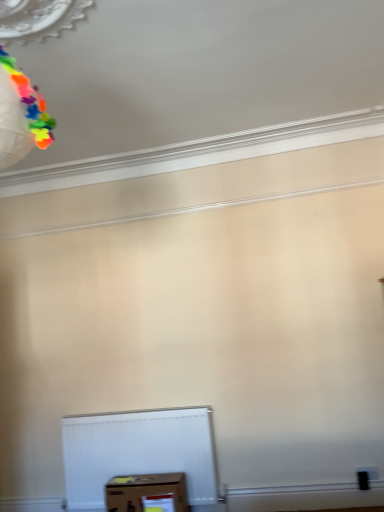
At what (x,y) coordinates should I click in order to perform the action: click on brown cardboard box at lower center. Please return your answer as a coordinate pair (x, y). Image resolution: width=384 pixels, height=512 pixels. Looking at the image, I should click on (146, 492).

This screenshot has width=384, height=512. What do you see at coordinates (146, 492) in the screenshot?
I see `brown cardboard box at lower center` at bounding box center [146, 492].

The image size is (384, 512). What do you see at coordinates (30, 103) in the screenshot?
I see `multicolored paper at upper left` at bounding box center [30, 103].

The image size is (384, 512). I want to click on multicolored paper at upper left, so point(30,103).

The width and height of the screenshot is (384, 512). I want to click on brown cardboard box at lower center, so click(146, 492).

Can you confirm if multicolored paper at upper left is positioned to the left of brown cardboard box at lower center?

Yes.

Does multicolored paper at upper left lie in front of brown cardboard box at lower center?

Yes, multicolored paper at upper left is in front of brown cardboard box at lower center.

Does point (43, 132) come in front of point (115, 485)?

Yes, point (43, 132) is in front of point (115, 485).

From the image's perspective, is multicolored paper at upper left above or below brown cardboard box at lower center?

multicolored paper at upper left is situated higher than brown cardboard box at lower center in the image.

From a real-world perspective, who is located higher, multicolored paper at upper left or brown cardboard box at lower center?

multicolored paper at upper left, from a real-world perspective.

Considering the sizes of multicolored paper at upper left and brown cardboard box at lower center in the image, is multicolored paper at upper left wider or thinner than brown cardboard box at lower center?

multicolored paper at upper left is thinner than brown cardboard box at lower center.

In the scene shown: Considering the relative sizes of multicolored paper at upper left and brown cardboard box at lower center in the image provided, is multicolored paper at upper left shorter than brown cardboard box at lower center?

In fact, multicolored paper at upper left may be taller than brown cardboard box at lower center.

Considering the relative sizes of multicolored paper at upper left and brown cardboard box at lower center in the image provided, is multicolored paper at upper left smaller than brown cardboard box at lower center?

Yes, multicolored paper at upper left is smaller than brown cardboard box at lower center.

Is multicolored paper at upper left positioned beyond the bounds of brown cardboard box at lower center?

That's correct, multicolored paper at upper left is outside of brown cardboard box at lower center.

Are multicolored paper at upper left and brown cardboard box at lower center beside each other?

No, multicolored paper at upper left is not next to brown cardboard box at lower center.

Consider the image. Is multicolored paper at upper left looking in the opposite direction of brown cardboard box at lower center?

No, multicolored paper at upper left's orientation is not away from brown cardboard box at lower center.

What's the angular difference between multicolored paper at upper left and brown cardboard box at lower center's facing directions?

The angular difference between multicolored paper at upper left and brown cardboard box at lower center is 97.5 degrees.

How much distance is there between multicolored paper at upper left and brown cardboard box at lower center?

multicolored paper at upper left is 2.65 meters away from brown cardboard box at lower center.

Identify the location of balloon lying above the brown cardboard box at lower center (from the image's perspective). Image resolution: width=384 pixels, height=512 pixels. (30, 103).

Considering the relative positions of brown cardboard box at lower center and multicolored paper at upper left in the image provided, is brown cardboard box at lower center to the left of multicolored paper at upper left from the viewer's perspective?

Incorrect, brown cardboard box at lower center is not on the left side of multicolored paper at upper left.

Considering the positions of objects brown cardboard box at lower center and multicolored paper at upper left in the image provided, who is in front, brown cardboard box at lower center or multicolored paper at upper left?

multicolored paper at upper left is more forward.

Considering the points (173, 508) and (29, 100), which point is behind, point (173, 508) or point (29, 100)?

The point (173, 508) is farther from the camera.

From the image's perspective, is brown cardboard box at lower center on multicolored paper at upper left?

Incorrect, from the image's perspective, brown cardboard box at lower center is lower than multicolored paper at upper left.

From a real-world perspective, who is located lower, brown cardboard box at lower center or multicolored paper at upper left?

brown cardboard box at lower center, from a real-world perspective.

Consider the image. Is brown cardboard box at lower center thinner than multicolored paper at upper left?

No.

In terms of height, does brown cardboard box at lower center look taller or shorter compared to multicolored paper at upper left?

brown cardboard box at lower center is shorter than multicolored paper at upper left.

Does brown cardboard box at lower center have a smaller size compared to multicolored paper at upper left?

No.

Consider the image. Would you say brown cardboard box at lower center is inside or outside multicolored paper at upper left?

brown cardboard box at lower center lies outside multicolored paper at upper left.

Looking at this image, is brown cardboard box at lower center in contact with multicolored paper at upper left?

No, brown cardboard box at lower center is not in contact with multicolored paper at upper left.

Is brown cardboard box at lower center oriented towards multicolored paper at upper left?

No.

Can you tell me how much brown cardboard box at lower center and multicolored paper at upper left differ in facing direction?

The facing directions of brown cardboard box at lower center and multicolored paper at upper left are 97.5 degrees apart.

How far apart are brown cardboard box at lower center and multicolored paper at upper left?

The distance of brown cardboard box at lower center from multicolored paper at upper left is 2.65 meters.

Locate an element on the screen. box behind the multicolored paper at upper left is located at coordinates (146, 492).

The width and height of the screenshot is (384, 512). I want to click on box behind the multicolored paper at upper left, so click(x=146, y=492).

This screenshot has height=512, width=384. Find the location of `balloon above the brown cardboard box at lower center (from the image's perspective)`. balloon above the brown cardboard box at lower center (from the image's perspective) is located at coordinates (30, 103).